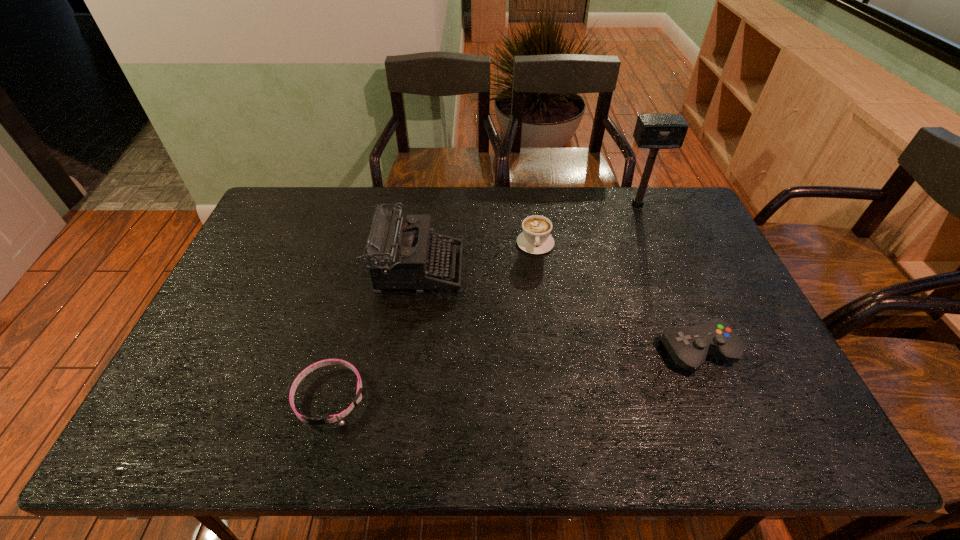
Locate which object is the second closest to the control. Please provide its 2D coordinates. Your answer should be formatted as a tuple, i.e. [(x, y)], where the tuple contains the x and y coordinates of a point satisfying the conditions above.

[(654, 131)]

Image resolution: width=960 pixels, height=540 pixels. In order to click on vacant area in the image that satisfies the following two spatial constraints: 1. on the typing side of the control; 2. on the left side of the second tallest object in this screenshot , I will do `click(406, 352)`.

Locate an element on the screen. free space that satisfies the following two spatial constraints: 1. on the typing side of the control; 2. on the right side of the fourth shortest object is located at coordinates (406, 352).

Identify the location of vacant space that satisfies the following two spatial constraints: 1. on the typing side of the typewriter; 2. on the right side of the control. The image size is (960, 540). (406, 352).

Where is `free space that satisfies the following two spatial constraints: 1. on the front side of the control; 2. on the left side of the mallet`? This screenshot has width=960, height=540. free space that satisfies the following two spatial constraints: 1. on the front side of the control; 2. on the left side of the mallet is located at coordinates click(697, 352).

Where is `vacant space that satisfies the following two spatial constraints: 1. on the front side of the mallet; 2. on the left side of the control`? Image resolution: width=960 pixels, height=540 pixels. vacant space that satisfies the following two spatial constraints: 1. on the front side of the mallet; 2. on the left side of the control is located at coordinates (697, 352).

You are a GUI agent. You are given a task and a screenshot of the screen. Output one action in this format:
    pyautogui.click(x=<x>, y=<y>)
    Task: Click on the vacant space that satisfies the following two spatial constraints: 1. to the right of the third object from right to left's handle; 2. on the typing side of the fourth shortest object
    
    Given the screenshot: What is the action you would take?
    pyautogui.click(x=539, y=269)